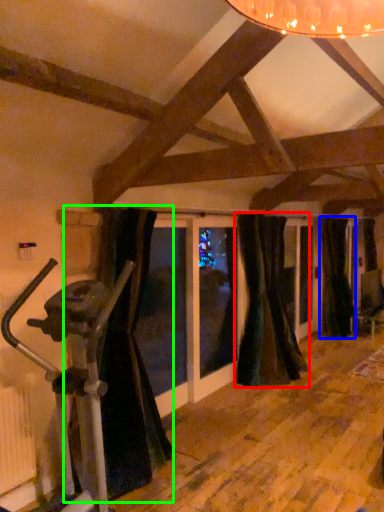
Question: Which object is positioned closest to curtain (highlighted by a red box)? Select from curtain (highlighted by a blue box) and curtain (highlighted by a green box).

Choices:
 (A) curtain
 (B) curtain

Answer: (A)